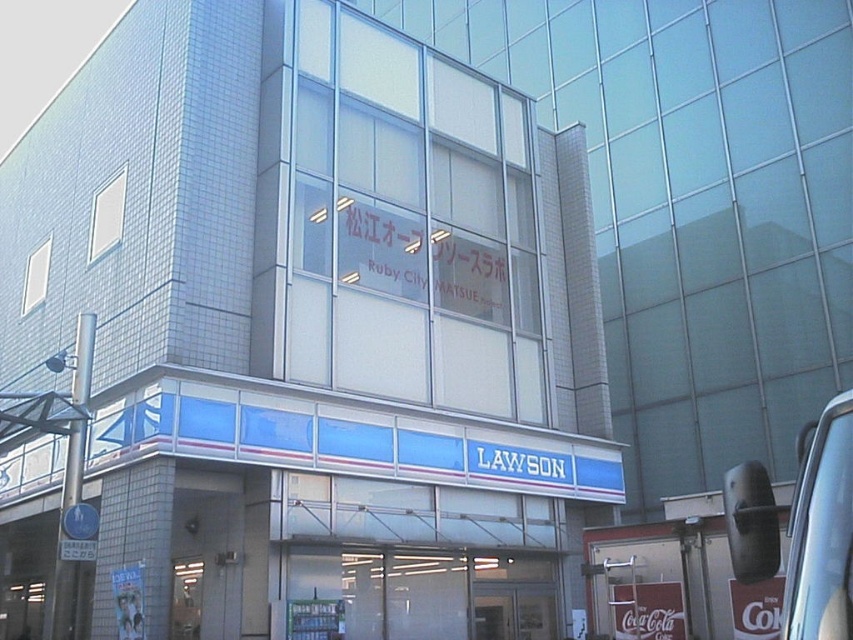
You are a delivery person trying to enter the building through the transparent glass door at lower center. However, you need to check your appearance in the metallic gray mirror at right before entering. Is the mirror large enough for you to see your full body?

The metallic gray mirror at right is bigger than the transparent glass door at lower center, so yes, the mirror is large enough for you to see your full body.

You are standing in front of the building and want to know if the metallic gray mirror at right is taller than the transparent glass door at lower center. Can you determine this based on the scene?

The metallic gray mirror at right is not as tall as the transparent glass door at lower center, so it is shorter.